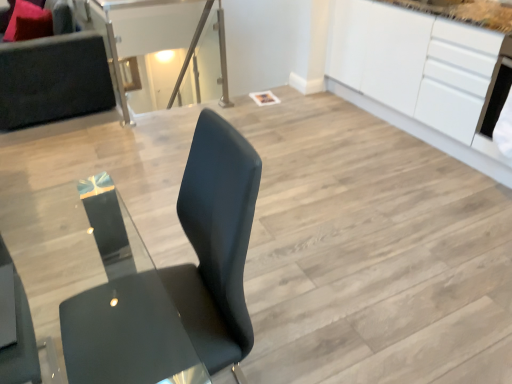
Measure the distance between dark gray fabric couch at upper left and camera.

The distance of dark gray fabric couch at upper left from camera is 3.08 meters.

What is the approximate height of dark gray fabric couch at upper left?

dark gray fabric couch at upper left is 34.84 inches in height.

This screenshot has height=384, width=512. What are the coordinates of `velvet pink pillow at upper left` in the screenshot? It's located at (28, 22).

The height and width of the screenshot is (384, 512). In order to click on matte black chair at lower left, the first chair in the top-to-bottom sequence in this screenshot , I will do `click(19, 336)`.

In the scene shown: From the image's perspective, is matte black chair at lower left, the second chair positioned from the bottom, below dark gray fabric couch at upper left?

Yes.

Based on the photo, is matte black chair at lower left, the first chair in the top-to-bottom sequence, oriented away from dark gray fabric couch at upper left?

No, matte black chair at lower left, the first chair in the top-to-bottom sequence,'s orientation is not away from dark gray fabric couch at upper left.

Can you confirm if matte black chair at lower left, the second chair positioned from the bottom, is smaller than dark gray fabric couch at upper left?

Yes, matte black chair at lower left, the second chair positioned from the bottom, is smaller than dark gray fabric couch at upper left.

Considering the positions of objects matte black chair at lower left, the second chair positioned from the bottom, and dark gray fabric couch at upper left in the image provided, who is in front, matte black chair at lower left, the second chair positioned from the bottom, or dark gray fabric couch at upper left?

matte black chair at lower left, the second chair positioned from the bottom.

Can white glossy cabinetry at upper right be found inside matte black chair at center, the 1th chair in the bottom-to-top sequence?

That's incorrect, white glossy cabinetry at upper right is not inside matte black chair at center, the 1th chair in the bottom-to-top sequence.

From a real-world perspective, is matte black chair at center, marked as the 2th chair in a top-to-bottom arrangement, physically located above or below white glossy cabinetry at upper right?

In terms of real-world spatial position, matte black chair at center, marked as the 2th chair in a top-to-bottom arrangement, is above white glossy cabinetry at upper right.

I want to click on chair that is the 2nd object located in front of the white glossy cabinetry at upper right, so click(213, 245).

Locate an element on the screen. pillow behind the matte black chair at lower left, the first chair in the top-to-bottom sequence is located at coordinates (28, 22).

Are matte black chair at lower left, the first chair in the top-to-bottom sequence, and velvet pink pillow at upper left far apart?

matte black chair at lower left, the first chair in the top-to-bottom sequence, is positioned a significant distance from velvet pink pillow at upper left.

Between matte black chair at lower left, the second chair positioned from the bottom, and velvet pink pillow at upper left, which one has more height?

Standing taller between the two is velvet pink pillow at upper left.

From a real-world perspective, is matte black chair at lower left, the first chair in the top-to-bottom sequence, located beneath velvet pink pillow at upper left?

Actually, matte black chair at lower left, the first chair in the top-to-bottom sequence, is physically above velvet pink pillow at upper left in the real world.

Considering the relative positions of transparent glass table at upper center and matte black chair at center, the 1th chair in the bottom-to-top sequence, in the image provided, is transparent glass table at upper center to the right of matte black chair at center, the 1th chair in the bottom-to-top sequence, from the viewer's perspective?

No, transparent glass table at upper center is not to the right of matte black chair at center, the 1th chair in the bottom-to-top sequence.

Does point (101, 20) come in front of point (237, 364)?

No, it is behind (237, 364).

I want to click on the 1st chair directly above the transparent glass table at upper center (from a real-world perspective), so click(x=213, y=245).

Who is more distant, transparent glass table at upper center or matte black chair at center, the 1th chair in the bottom-to-top sequence?

transparent glass table at upper center is further from the camera.

Does matte black chair at lower left, the first chair in the top-to-bottom sequence, come behind transparent glass table at upper center?

That is False.

From the image's perspective, is matte black chair at lower left, the second chair positioned from the bottom, positioned above or below transparent glass table at upper center?

matte black chair at lower left, the second chair positioned from the bottom, is below transparent glass table at upper center.

Considering the relative sizes of matte black chair at lower left, the second chair positioned from the bottom, and transparent glass table at upper center in the image provided, is matte black chair at lower left, the second chair positioned from the bottom, taller than transparent glass table at upper center?

No.

From a real-world perspective, who is located higher, velvet pink pillow at upper left or dark gray fabric couch at upper left?

velvet pink pillow at upper left.

Based on their positions, is velvet pink pillow at upper left located to the left or right of dark gray fabric couch at upper left?

Based on their positions, velvet pink pillow at upper left is located to the left of dark gray fabric couch at upper left.

Who is smaller, velvet pink pillow at upper left or dark gray fabric couch at upper left?

Smaller between the two is velvet pink pillow at upper left.

How far apart are velvet pink pillow at upper left and dark gray fabric couch at upper left?

They are 13.53 inches apart.

From the image's perspective, which is below, transparent glass table at upper center or white glossy cabinetry at upper right?

From the image's view, white glossy cabinetry at upper right is below.

Is point (221, 71) more distant than point (391, 107)?

Yes, it is behind point (391, 107).

Considering the positions of objects transparent glass table at upper center and white glossy cabinetry at upper right in the image provided, who is more to the right, transparent glass table at upper center or white glossy cabinetry at upper right?

white glossy cabinetry at upper right.

You are a GUI agent. You are given a task and a screenshot of the screen. Output one action in this format:
    pyautogui.click(x=<x>, y=<y>)
    Task: Click on the 1st chair to the right when counting from the dark gray fabric couch at upper left
    
    Given the screenshot: What is the action you would take?
    pyautogui.click(x=19, y=336)

Find the location of a particular element. This screenshot has height=384, width=512. cabinetry behind the matte black chair at center, the 1th chair in the bottom-to-top sequence is located at coordinates click(417, 75).

In the scene shown: Which object lies further to the anchor point transparent glass table at upper center, white glossy cabinetry at upper right or matte black chair at center, marked as the 2th chair in a top-to-bottom arrangement?

matte black chair at center, marked as the 2th chair in a top-to-bottom arrangement, is positioned further to the anchor transparent glass table at upper center.

When comparing their distances from velvet pink pillow at upper left, does transparent glass table at upper center or matte black chair at center, the 1th chair in the bottom-to-top sequence, seem closer?

The object closer to velvet pink pillow at upper left is transparent glass table at upper center.

From the image, which object appears to be nearer to transparent glass table at upper center, dark gray fabric couch at upper left or matte black chair at center, the 1th chair in the bottom-to-top sequence?

dark gray fabric couch at upper left.

Considering their positions, is matte black chair at center, marked as the 2th chair in a top-to-bottom arrangement, positioned further to white glossy cabinetry at upper right than matte black chair at lower left, the second chair positioned from the bottom?

The object further to white glossy cabinetry at upper right is matte black chair at lower left, the second chair positioned from the bottom.

Which object lies nearer to the anchor point transparent glass table at upper center, matte black chair at center, marked as the 2th chair in a top-to-bottom arrangement, or dark gray fabric couch at upper left?

Among the two, dark gray fabric couch at upper left is located nearer to transparent glass table at upper center.

When comparing their distances from white glossy cabinetry at upper right, does velvet pink pillow at upper left or dark gray fabric couch at upper left seem closer?

dark gray fabric couch at upper left is positioned closer to the anchor white glossy cabinetry at upper right.

From the image, which object appears to be farther from transparent glass table at upper center, velvet pink pillow at upper left or matte black chair at lower left, the second chair positioned from the bottom?

matte black chair at lower left, the second chair positioned from the bottom, lies further to transparent glass table at upper center than the other object.

When comparing their distances from velvet pink pillow at upper left, does transparent glass table at upper center or white glossy cabinetry at upper right seem further?

Based on the image, white glossy cabinetry at upper right appears to be further to velvet pink pillow at upper left.

You are a GUI agent. You are given a task and a screenshot of the screen. Output one action in this format:
    pyautogui.click(x=<x>, y=<y>)
    Task: Click on the couch between matte black chair at lower left, the second chair positioned from the bottom, and transparent glass table at upper center in the front-back direction
    
    Given the screenshot: What is the action you would take?
    pyautogui.click(x=53, y=79)

You are a GUI agent. You are given a task and a screenshot of the screen. Output one action in this format:
    pyautogui.click(x=<x>, y=<y>)
    Task: Click on the chair between matte black chair at center, the 1th chair in the bottom-to-top sequence, and dark gray fabric couch at upper left in the front-back direction
    
    Given the screenshot: What is the action you would take?
    [19, 336]

The height and width of the screenshot is (384, 512). Find the location of `chair located between matte black chair at center, the 1th chair in the bottom-to-top sequence, and velvet pink pillow at upper left in the depth direction`. chair located between matte black chair at center, the 1th chair in the bottom-to-top sequence, and velvet pink pillow at upper left in the depth direction is located at coordinates (19, 336).

In order to click on table between matte black chair at center, the 1th chair in the bottom-to-top sequence, and velvet pink pillow at upper left, along the z-axis in this screenshot , I will do `click(165, 49)`.